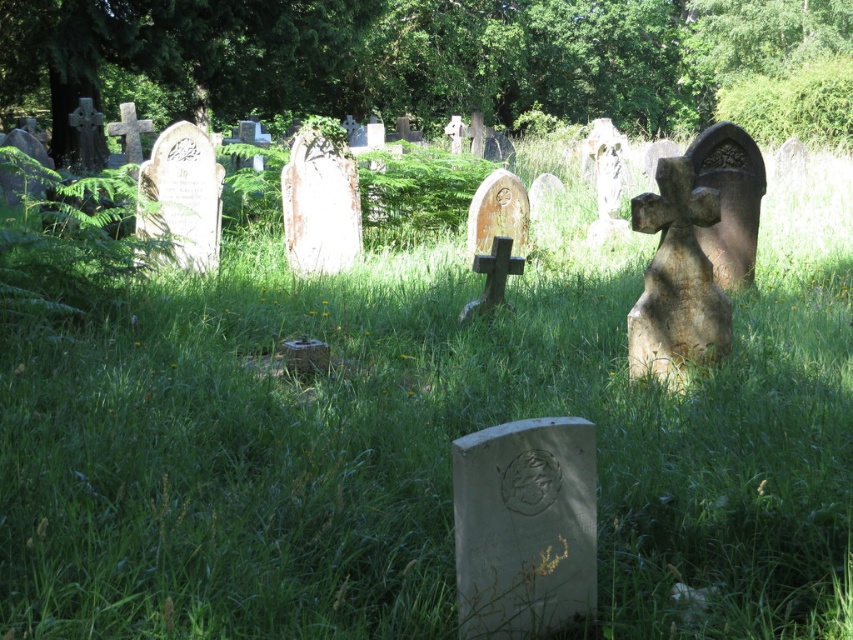
Can you confirm if green leafy tree at upper center is positioned to the left of gray stone gravestone at center?

In fact, green leafy tree at upper center is to the right of gray stone gravestone at center.

The height and width of the screenshot is (640, 853). Describe the element at coordinates (415, 54) in the screenshot. I see `green leafy tree at upper center` at that location.

This screenshot has height=640, width=853. Identify the location of green leafy tree at upper center. (415, 54).